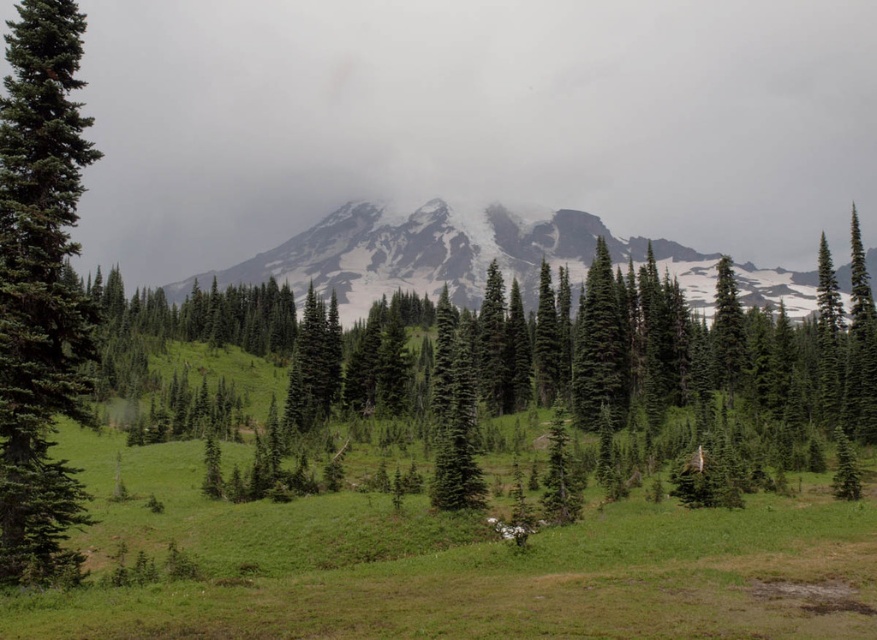
You are planning to take a photo of the snowy granite mountain at center and the green matte tree at left. Which object will appear wider in the photo?

The snowy granite mountain at center will appear wider in the photo because its width is greater than the green matte tree at left.

You are a hiker planning to take a photo of the green matte tree at center and the green matte tree at left. Which tree should you stand closer to if you want both trees to appear the same size in your photo?

To make both the green matte tree at center and the green matte tree at left appear the same size in your photo, you should stand closer to the green matte tree at left since it is smaller and needs to be magnified to match the size of the larger green matte tree at center.